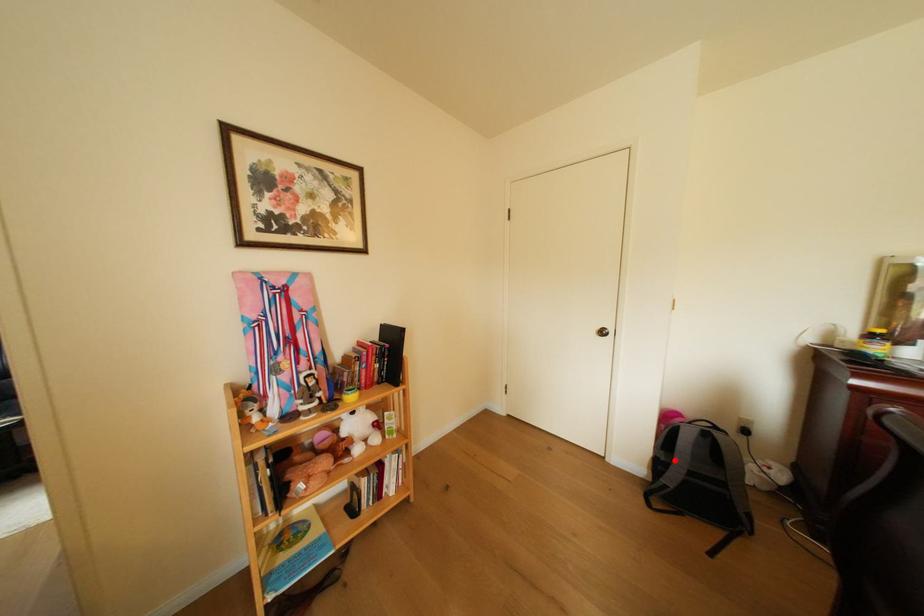
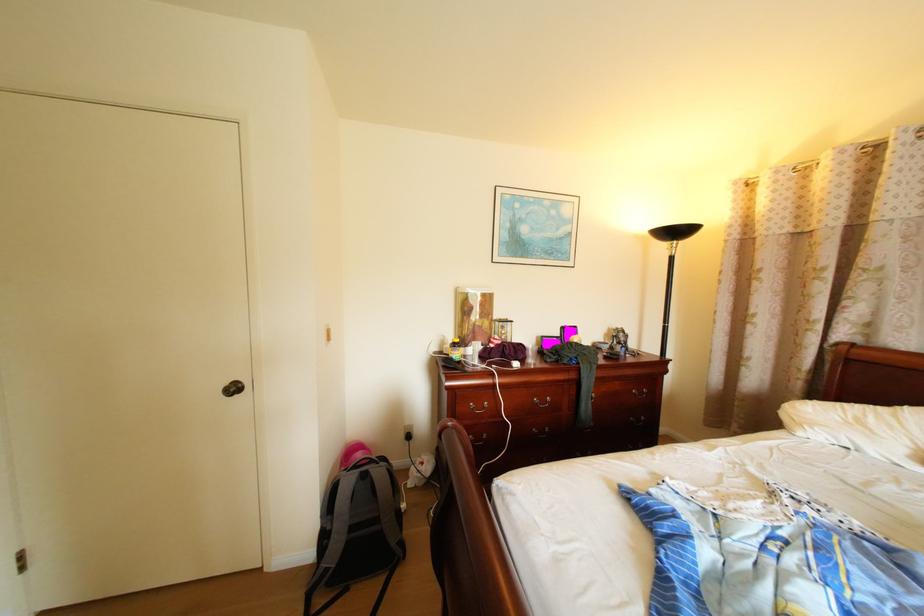
Question: I am providing you with two images of the same scene from different viewpoints. Given a red point in image1, look at the same physical point in image2. Is it:

Choices:
 (A) Closer to the viewpoint
 (B) Farther from the viewpoint

Answer: (B)